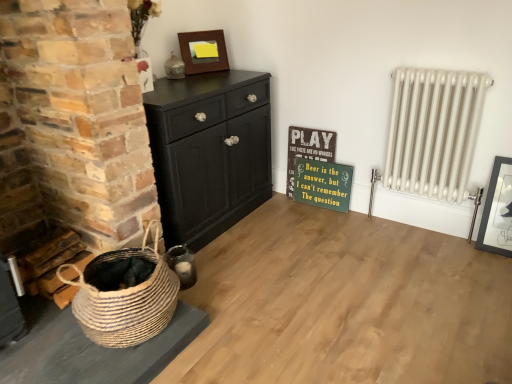
Question: Does green painted wood signboard at center-right have a smaller size compared to wooden picture frame at upper center, placed as the 1th picture frame when sorted from top to bottom?

Choices:
 (A) no
 (B) yes

Answer: (A)

Question: Does green painted wood signboard at center-right appear on the left side of wooden picture frame at upper center, the second picture frame from the bottom?

Choices:
 (A) yes
 (B) no

Answer: (B)

Question: Is green painted wood signboard at center-right surrounding wooden picture frame at upper center, placed as the second picture frame when sorted from front to back?

Choices:
 (A) no
 (B) yes

Answer: (A)

Question: Is green painted wood signboard at center-right touching wooden picture frame at upper center, placed as the second picture frame when sorted from front to back?

Choices:
 (A) no
 (B) yes

Answer: (A)

Question: Considering the relative positions of green painted wood signboard at center-right and wooden picture frame at upper center, which is counted as the 1th picture frame, starting from the back, in the image provided, is green painted wood signboard at center-right to the right of wooden picture frame at upper center, which is counted as the 1th picture frame, starting from the back, from the viewer's perspective?

Choices:
 (A) no
 (B) yes

Answer: (B)

Question: Is wooden signboard at center inside or outside of green painted wood signboard at center-right?

Choices:
 (A) inside
 (B) outside

Answer: (A)

Question: Is wooden signboard at center in front of or behind green painted wood signboard at center-right in the image?

Choices:
 (A) front
 (B) behind

Answer: (B)

Question: Considering the relative positions of wooden signboard at center and green painted wood signboard at center-right in the image provided, is wooden signboard at center to the left or to the right of green painted wood signboard at center-right?

Choices:
 (A) right
 (B) left

Answer: (B)

Question: Considering the positions of wooden signboard at center and green painted wood signboard at center-right in the image, is wooden signboard at center wider or thinner than green painted wood signboard at center-right?

Choices:
 (A) thin
 (B) wide

Answer: (A)

Question: From the image's perspective, is green painted wood signboard at center-right above or below wooden picture frame at upper center, arranged as the first picture frame when viewed from the left?

Choices:
 (A) below
 (B) above

Answer: (A)

Question: Considering the relative positions of green painted wood signboard at center-right and wooden picture frame at upper center, the second picture frame from the bottom, in the image provided, is green painted wood signboard at center-right to the left or to the right of wooden picture frame at upper center, the second picture frame from the bottom,?

Choices:
 (A) right
 (B) left

Answer: (A)

Question: Is green painted wood signboard at center-right inside or outside of wooden picture frame at upper center, placed as the 1th picture frame when sorted from top to bottom?

Choices:
 (A) outside
 (B) inside

Answer: (A)

Question: From a real-world perspective, is green painted wood signboard at center-right above or below wooden picture frame at upper center, placed as the 1th picture frame when sorted from top to bottom?

Choices:
 (A) above
 (B) below

Answer: (B)

Question: Considering the positions of white metal radiator at right and matte black picture frame at right, acting as the first picture frame starting from the bottom, in the image, is white metal radiator at right taller or shorter than matte black picture frame at right, acting as the first picture frame starting from the bottom,?

Choices:
 (A) short
 (B) tall

Answer: (B)

Question: Considering the positions of point (458, 72) and point (507, 248), is point (458, 72) closer or farther from the camera than point (507, 248)?

Choices:
 (A) closer
 (B) farther

Answer: (A)